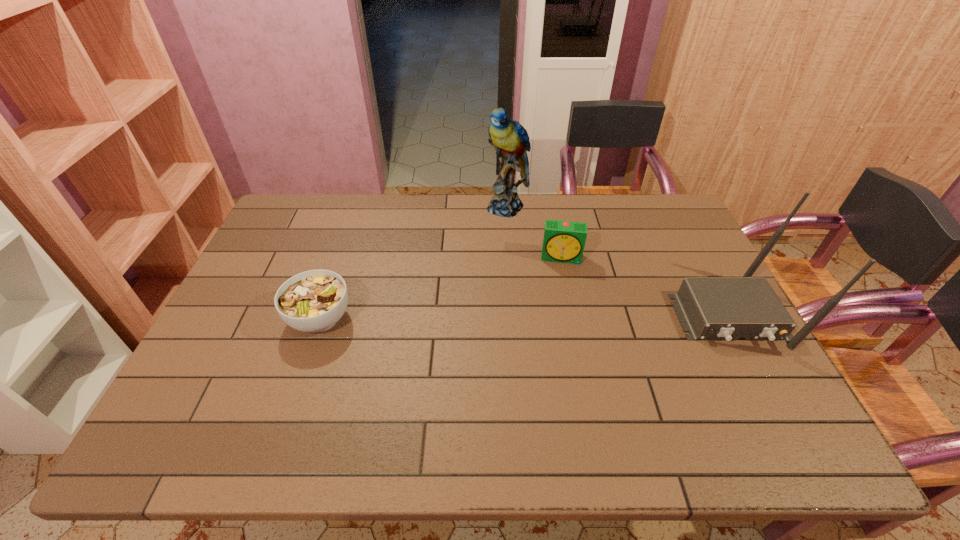
Find the location of a particular element. This screenshot has width=960, height=540. vacant space on the desktop that is between the soup bowl and the router and is positioned on the front-facing side of the alarm clock is located at coordinates (560, 318).

Find the location of `free space on the desktop that is between the soup bowl and the rightmost object and is positioned on the face of the third object from right to left`. free space on the desktop that is between the soup bowl and the rightmost object and is positioned on the face of the third object from right to left is located at coordinates (474, 318).